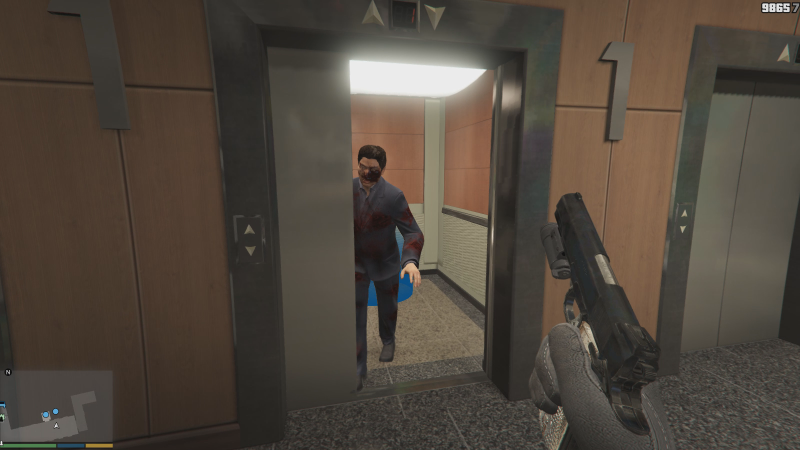
Where is `floor`? The width and height of the screenshot is (800, 450). floor is located at coordinates (752, 428).